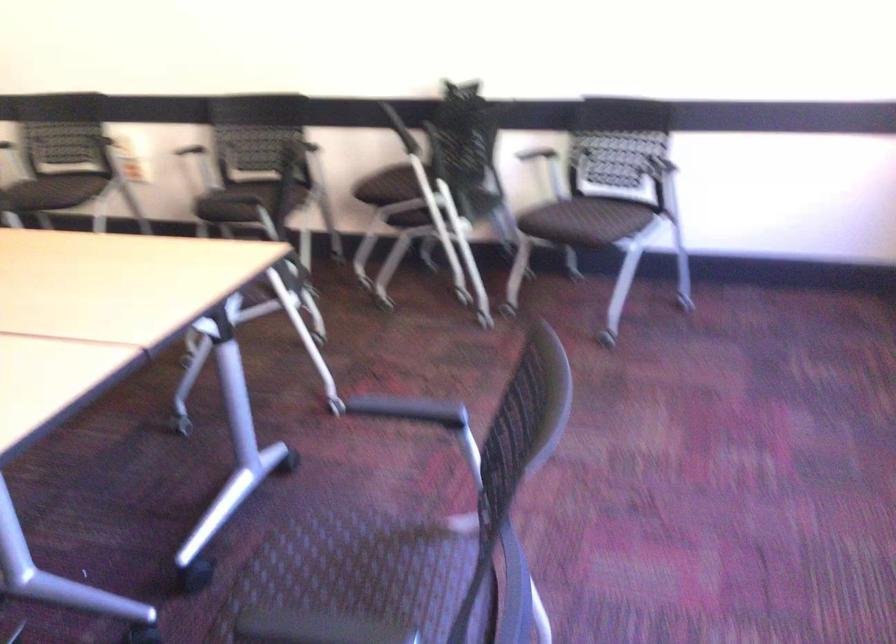
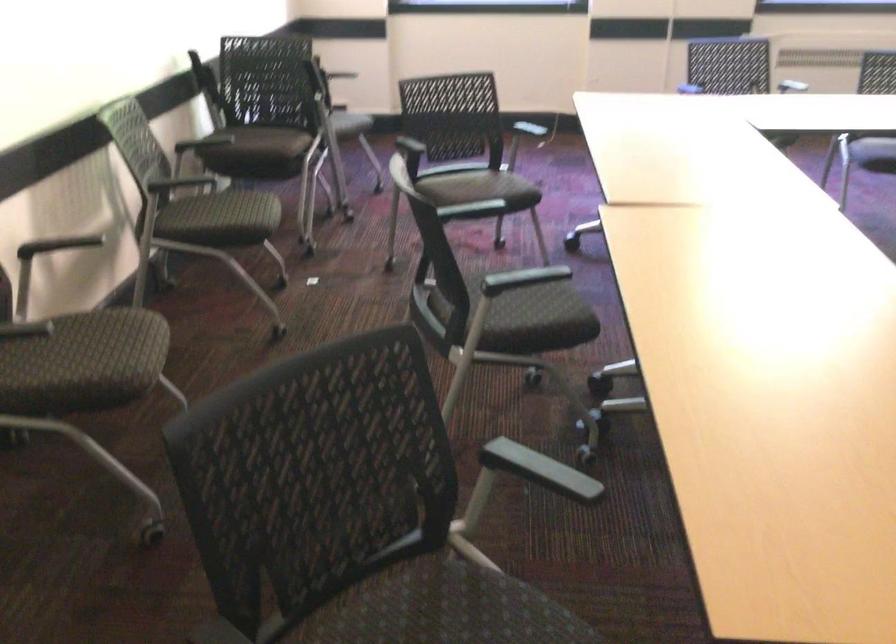
Where in the second image is the point corresponding to the point at 306,169 from the first image?

(168, 187)